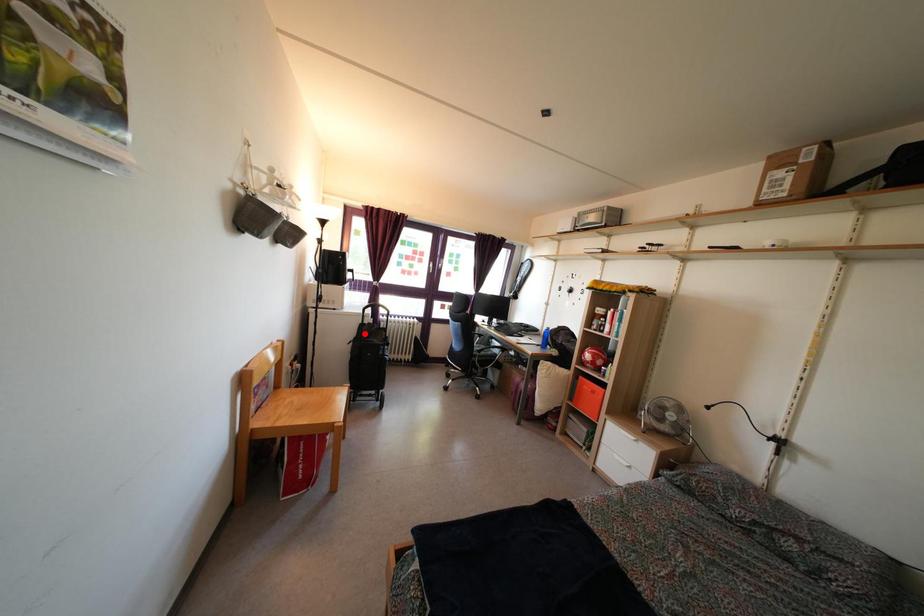
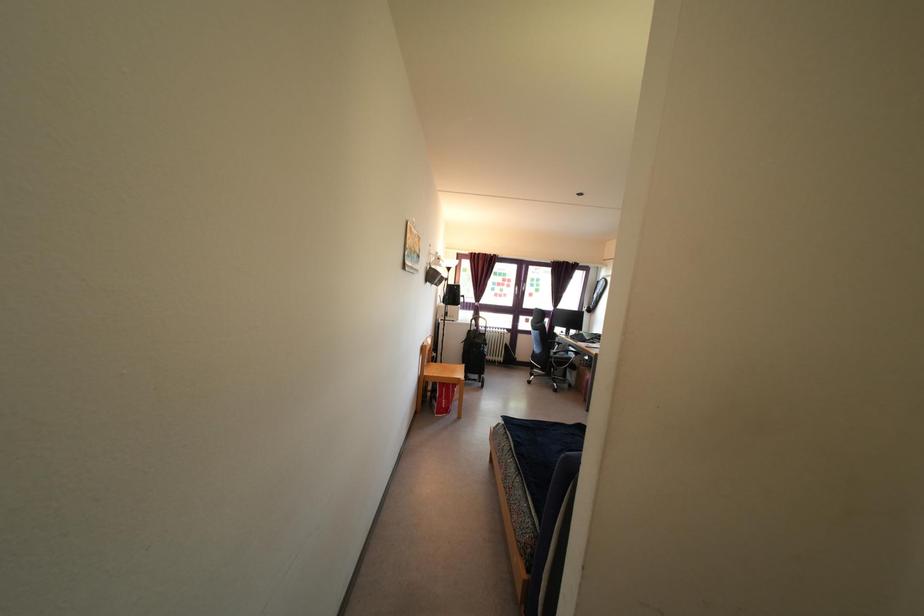
In the second image, find the point that corresponds to the highlighted location in the first image.

(472, 339)